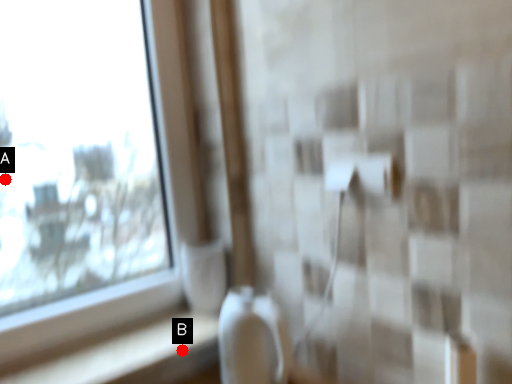
Question: Two points are circled on the image, labeled by A and B beside each circle. Which point is further to the camera?

Choices:
 (A) A is further
 (B) B is further

Answer: (A)